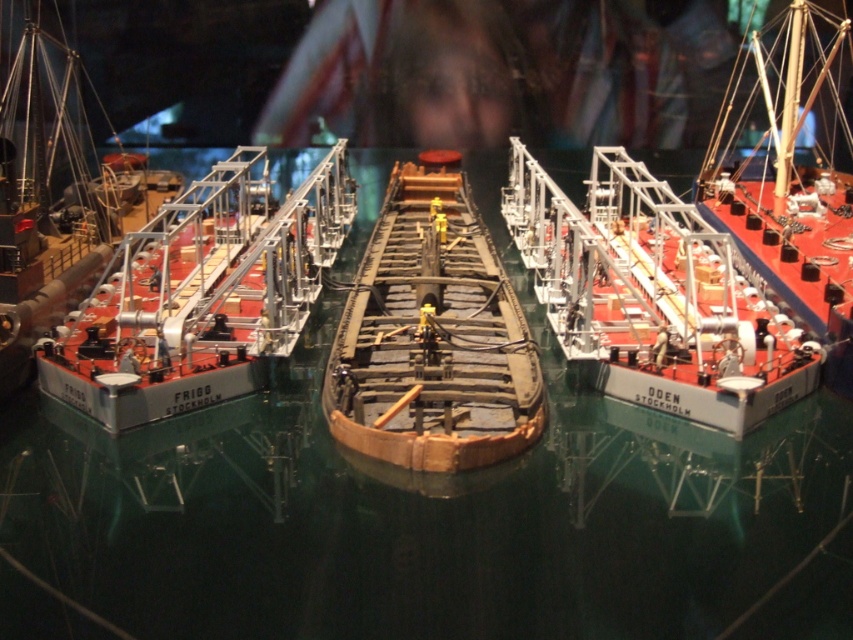
Is the position of brown wooden boat at center less distant than that of wooden ship at right?

Yes, it is in front of wooden ship at right.

Does point (465, 314) come behind point (799, 202)?

That is False.

You are a GUI agent. You are given a task and a screenshot of the screen. Output one action in this format:
    pyautogui.click(x=<x>, y=<y>)
    Task: Click on the brown wooden boat at center
    Image resolution: width=853 pixels, height=640 pixels.
    Given the screenshot: What is the action you would take?
    pyautogui.click(x=432, y=337)

In the scene shown: Does white matte ship at center have a greater height compared to brown wooden boat at center?

Indeed, white matte ship at center has a greater height compared to brown wooden boat at center.

Between point (553, 276) and point (531, 388), which one is positioned in front?

Point (531, 388) is in front.

Measure the distance between white matte ship at center and camera.

The distance of white matte ship at center from camera is 8.44 feet.

Where is `white matte ship at center`? The height and width of the screenshot is (640, 853). white matte ship at center is located at coordinates (653, 296).

Who is higher up, matte brown wooden boat at center or brown wooden boat at center?

matte brown wooden boat at center is above.

Is point (312, 294) positioned in front of point (453, 324)?

No, it is behind (453, 324).

Is point (265, 298) positioned in front of point (373, 412)?

No, it is not.

Where is `matte brown wooden boat at center`? matte brown wooden boat at center is located at coordinates (201, 294).